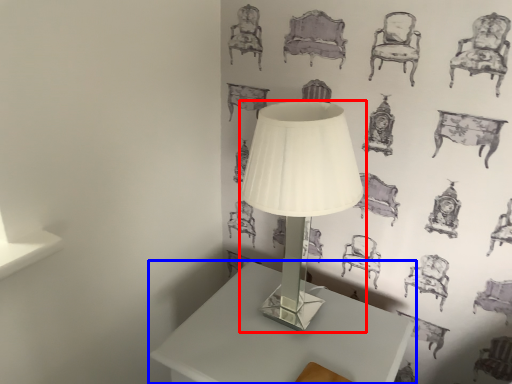
Question: Which of the following is the farthest to the observer, lamp (highlighted by a red box) or table (highlighted by a blue box)?

Choices:
 (A) lamp
 (B) table

Answer: (B)